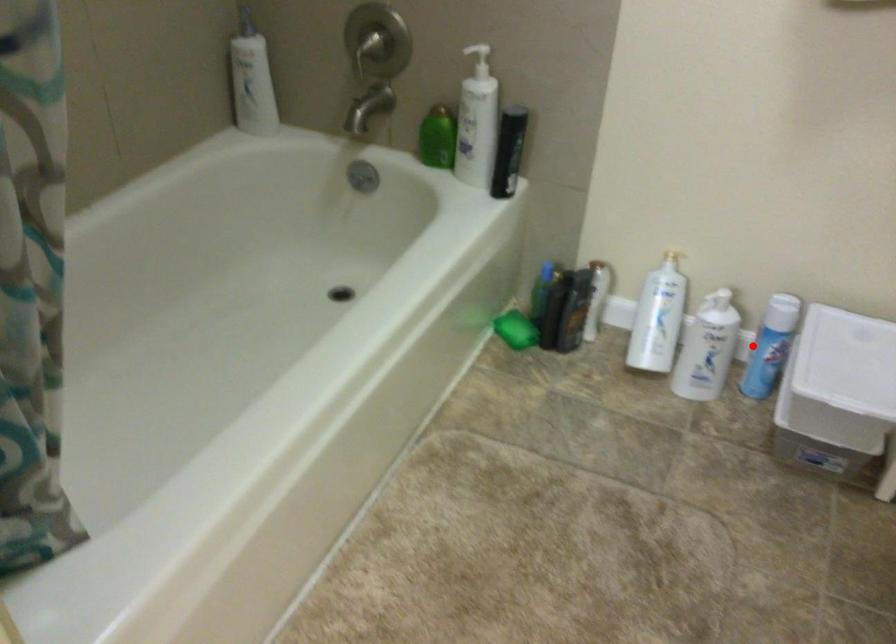
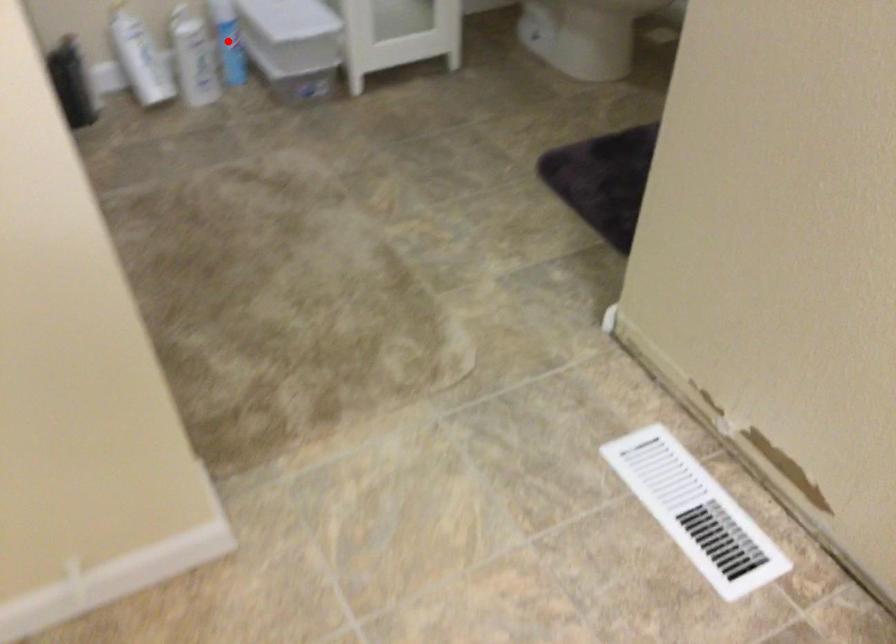
I am providing you with two images of the same scene from different viewpoints. A red point is marked on the first image and another point is marked on the second image. Does the point marked in image1 correspond to the same location as the one in image2?

Yes